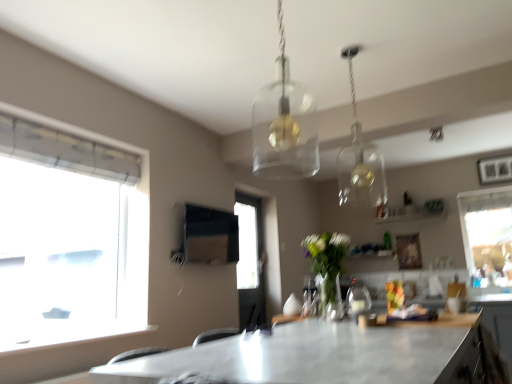
Where is `blank space above clear glass pendant light at upper center, which is counted as the second lamp, starting from the front (from a real-world perspective)`? Image resolution: width=512 pixels, height=384 pixels. blank space above clear glass pendant light at upper center, which is counted as the second lamp, starting from the front (from a real-world perspective) is located at coordinates (346, 49).